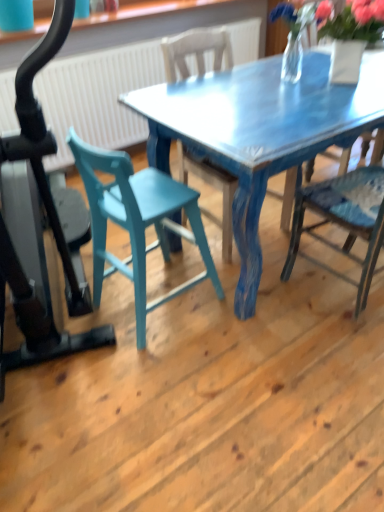
Question: Could you tell me if blue painted wood chair at right, which is the first chair from right to left, is turned towards teal wood chair at center, which appears as the first chair when viewed from the left?

Choices:
 (A) yes
 (B) no

Answer: (B)

Question: Is blue painted wood chair at right, which is the first chair from right to left, surrounding teal wood chair at center, the third chair positioned from the right?

Choices:
 (A) no
 (B) yes

Answer: (A)

Question: From a real-world perspective, is blue painted wood chair at right, the third chair positioned from the left, on teal wood chair at center, which appears as the first chair when viewed from the left?

Choices:
 (A) yes
 (B) no

Answer: (A)

Question: Is blue painted wood chair at right, which is the first chair from right to left, further to the viewer compared to teal wood chair at center, the third chair positioned from the right?

Choices:
 (A) yes
 (B) no

Answer: (B)

Question: Does blue painted wood chair at right, which is the first chair from right to left, have a greater width compared to teal wood chair at center, which appears as the first chair when viewed from the left?

Choices:
 (A) yes
 (B) no

Answer: (A)

Question: Is the surface of blue painted wood chair at right, which is the first chair from right to left, in direct contact with teal wood chair at center, which appears as the first chair when viewed from the left?

Choices:
 (A) yes
 (B) no

Answer: (B)

Question: Is blue painted wood chair at center, which is the 2th chair in left-to-right order, looking in the opposite direction of teal wood chair at center, the third chair positioned from the right?

Choices:
 (A) no
 (B) yes

Answer: (A)

Question: From the image's perspective, would you say blue painted wood chair at center, the 2th chair positioned from the right, is shown under teal wood chair at center, which appears as the first chair when viewed from the left?

Choices:
 (A) yes
 (B) no

Answer: (B)

Question: Does blue painted wood chair at center, which is the 2th chair in left-to-right order, contain teal wood chair at center, which appears as the first chair when viewed from the left?

Choices:
 (A) no
 (B) yes

Answer: (A)

Question: Is blue painted wood chair at center, the 2th chair positioned from the right, next to teal wood chair at center, which appears as the first chair when viewed from the left?

Choices:
 (A) no
 (B) yes

Answer: (A)

Question: Is blue painted wood chair at center, the 2th chair positioned from the right, smaller than teal wood chair at center, which appears as the first chair when viewed from the left?

Choices:
 (A) no
 (B) yes

Answer: (A)

Question: Can you confirm if blue painted wood chair at center, the 2th chair positioned from the right, is positioned to the left of teal wood chair at center, which appears as the first chair when viewed from the left?

Choices:
 (A) no
 (B) yes

Answer: (A)

Question: From the image's perspective, is teal wood chair at center, the third chair positioned from the right, on top of blue painted wood chair at center, which is the 2th chair in left-to-right order?

Choices:
 (A) yes
 (B) no

Answer: (B)